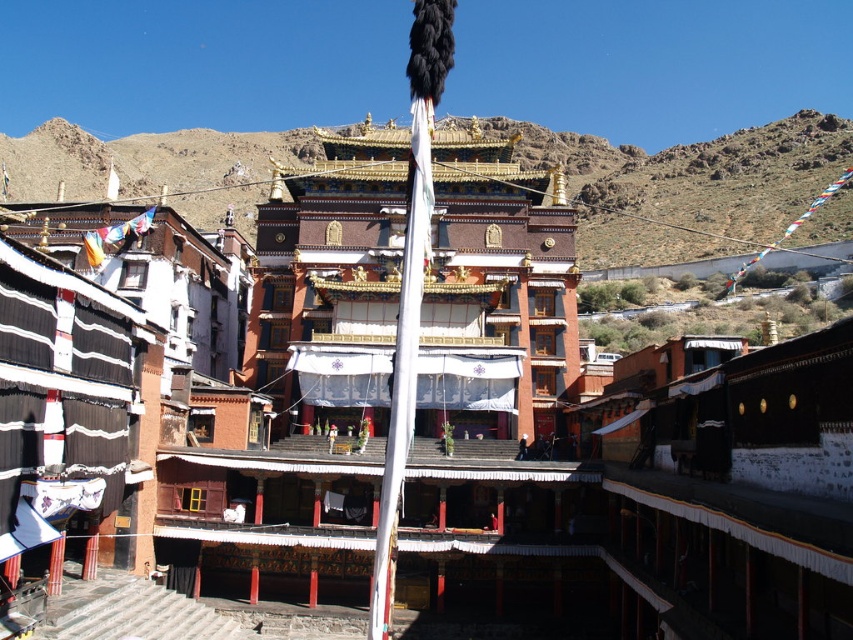
Question: Is brown rocky mountain at upper center positioned in front of white fabric flag pole at center?

Choices:
 (A) no
 (B) yes

Answer: (A)

Question: In this image, where is brown rocky mountain at upper center located relative to white fabric flag pole at center?

Choices:
 (A) left
 (B) right

Answer: (A)

Question: Considering the relative positions of brown rocky mountain at upper center and white fabric flag pole at center in the image provided, where is brown rocky mountain at upper center located with respect to white fabric flag pole at center?

Choices:
 (A) left
 (B) right

Answer: (A)